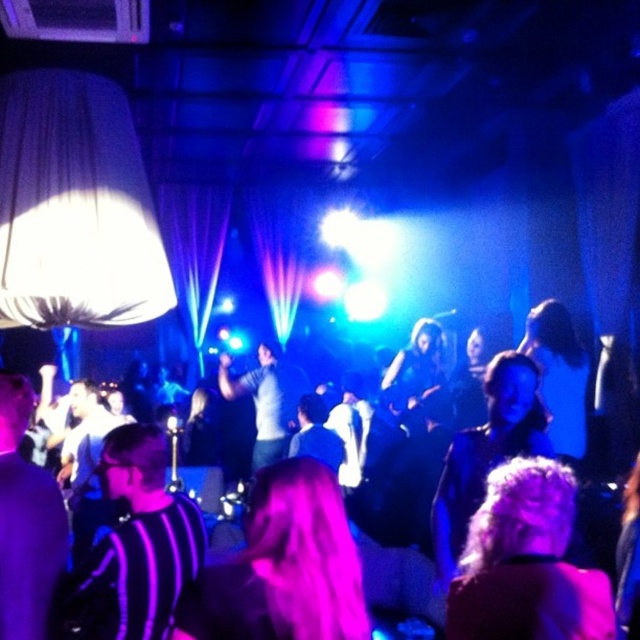
You are standing at the center of the room and want to locate the striped fabric shirt at center. According to the coordinates provided, in which direction should you look to find it?

The striped fabric shirt at center is located at coordinates point (524, 406). Since you are at the center of the room, you should look towards the lower right direction to find it.